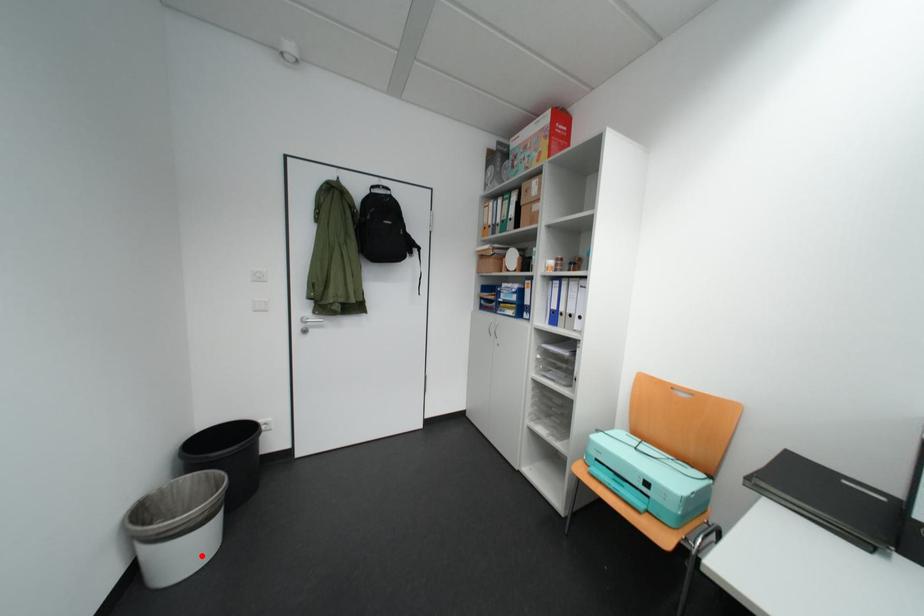
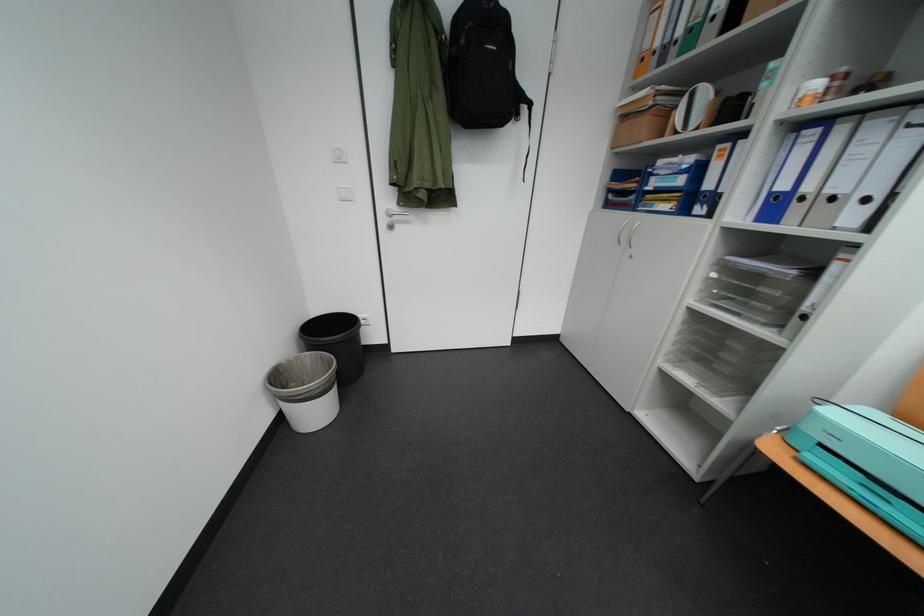
Where in the second image is the point corresponding to the highlighted location from the first image?

(329, 415)